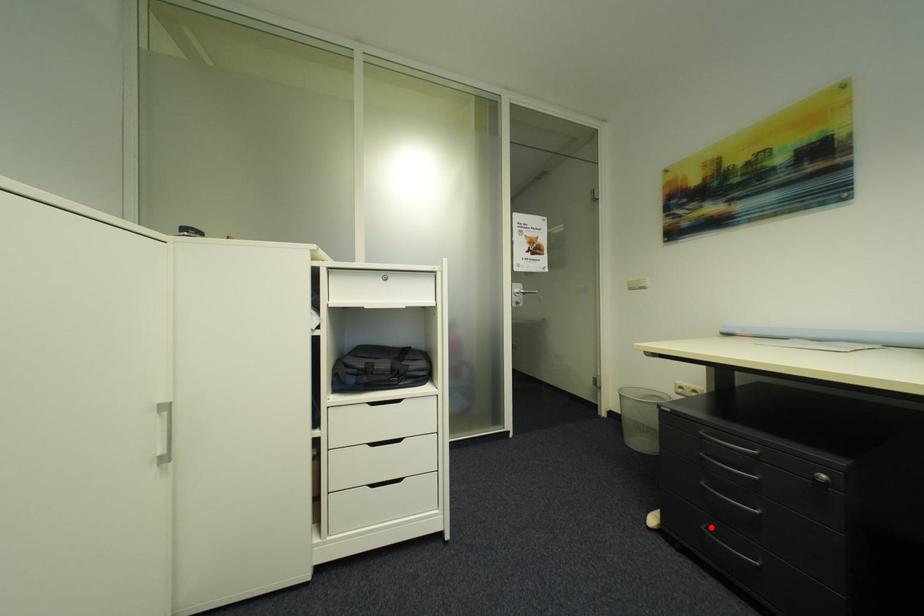
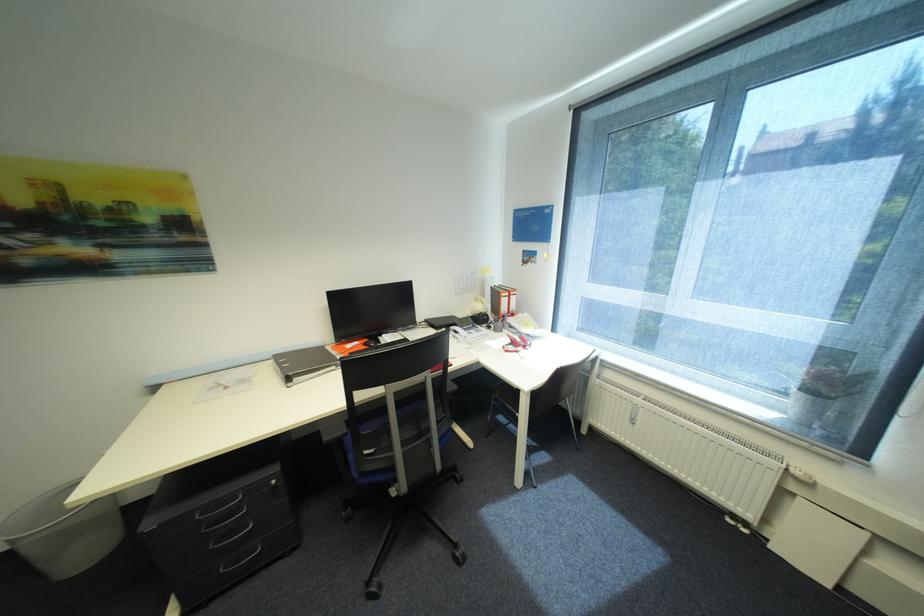
Question: I am providing you with two images of the same scene from different viewpoints. Image1 has a red point marked. In image2, the corresponding 3D location appears at what relative position? Reply with the corresponding letter.

Choices:
 (A) Closer
 (B) Farther

Answer: (A)